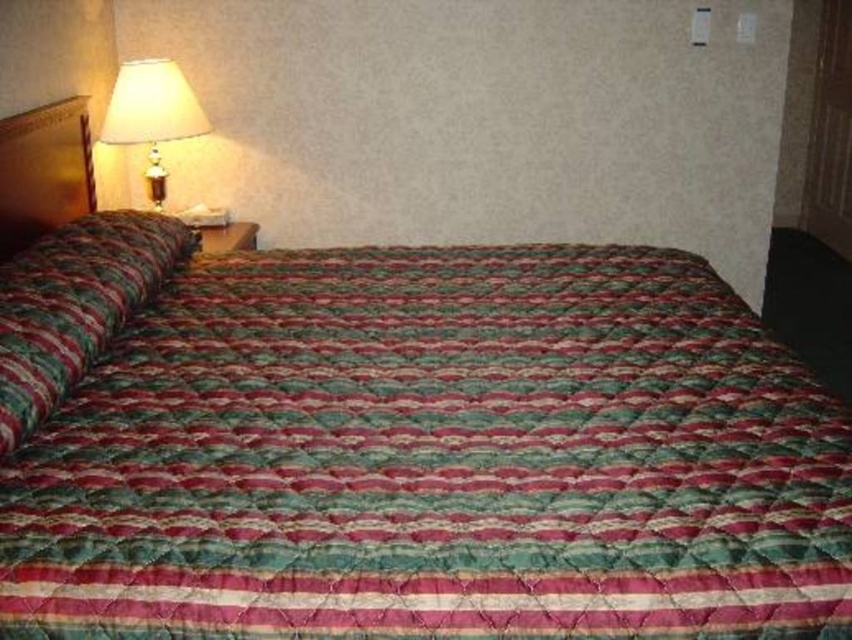
Who is positioned more to the right, quilted fabric blanket at center or textured cotton pillow at left?

quilted fabric blanket at center is more to the right.

Consider the image. Does quilted fabric blanket at center have a lesser height compared to textured cotton pillow at left?

No, quilted fabric blanket at center is not shorter than textured cotton pillow at left.

Which is behind, point (317, 442) or point (167, 228)?

Point (167, 228)

Locate an element on the screen. quilted fabric blanket at center is located at coordinates (435, 458).

Is textured cotton pillow at left above matte cream lampshade at upper left?

Incorrect, textured cotton pillow at left is not positioned above matte cream lampshade at upper left.

Who is taller, textured cotton pillow at left or matte cream lampshade at upper left?

textured cotton pillow at left

You are a GUI agent. You are given a task and a screenshot of the screen. Output one action in this format:
    pyautogui.click(x=<x>, y=<y>)
    Task: Click on the textured cotton pillow at left
    
    Given the screenshot: What is the action you would take?
    pyautogui.click(x=73, y=305)

Can you confirm if quilted fabric blanket at center is smaller than matte cream lampshade at upper left?

Actually, quilted fabric blanket at center might be larger than matte cream lampshade at upper left.

Which is behind, point (118, 460) or point (165, 134)?

Point (165, 134)

Identify the location of quilted fabric blanket at center. (435, 458).

This screenshot has width=852, height=640. I want to click on quilted fabric blanket at center, so click(435, 458).